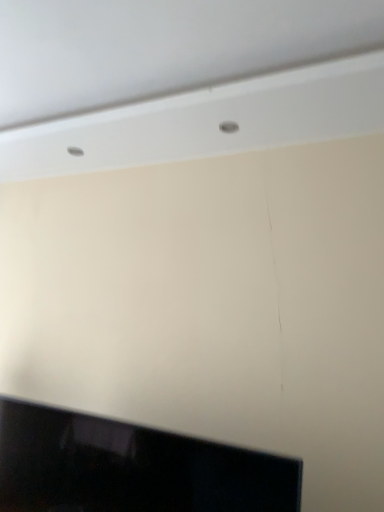
You are a GUI agent. You are given a task and a screenshot of the screen. Output one action in this format:
    pyautogui.click(x=<x>, y=<y>)
    Task: Click on the black glossy tv at bottom
    
    Given the screenshot: What is the action you would take?
    pyautogui.click(x=131, y=468)

The image size is (384, 512). What do you see at coordinates (131, 468) in the screenshot? I see `black glossy tv at bottom` at bounding box center [131, 468].

Where is `black glossy tv at bottom`? This screenshot has height=512, width=384. black glossy tv at bottom is located at coordinates (131, 468).